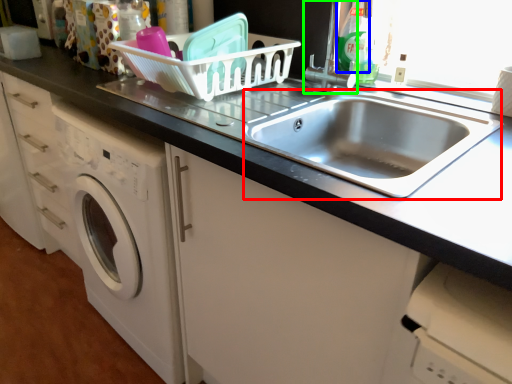
Question: Which object is the closest to the sink (highlighted by a red box)? Choose among these: cleaning product (highlighted by a blue box) or faucet (highlighted by a green box).

Choices:
 (A) cleaning product
 (B) faucet

Answer: (B)